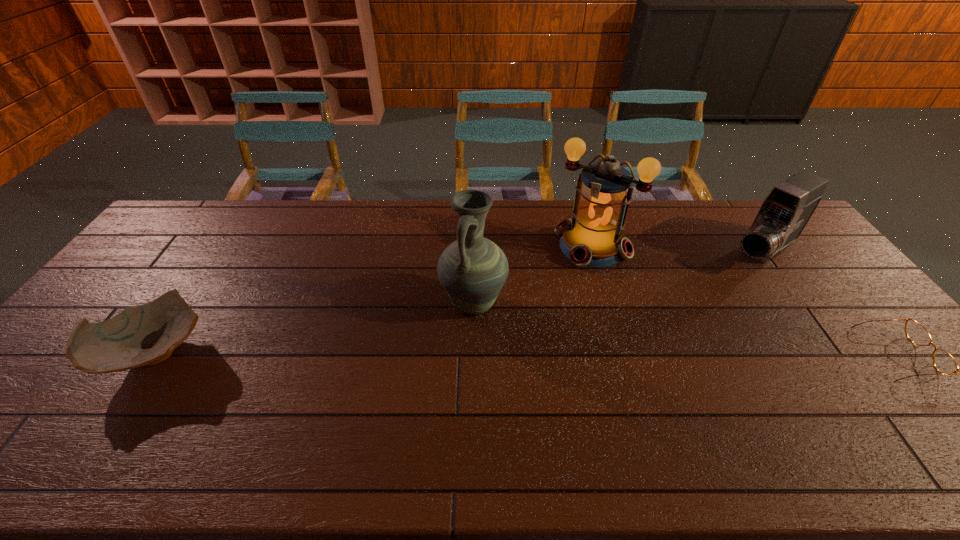
Image resolution: width=960 pixels, height=540 pixels. In order to click on free space located 0.080m at the front of the camcorder, highlighting the lens in this screenshot , I will do `click(726, 278)`.

This screenshot has height=540, width=960. Identify the location of free space located 0.260m at the front of the camcorder, highlighting the lens. (690, 303).

This screenshot has width=960, height=540. What are the coordinates of `vacant area situated at the front of the camcorder, highlighting the lens` in the screenshot? It's located at (692, 301).

At what (x,y) coordinates should I click in order to perform the action: click on vacant space located on the handle side of the fourth object from right to left. Please return your answer as a coordinate pair (x, y). Looking at the image, I should click on (401, 366).

You are a GUI agent. You are given a task and a screenshot of the screen. Output one action in this format:
    pyautogui.click(x=<x>, y=<y>)
    Task: Click on the free region located on the handle side of the fourth object from right to left
    Image resolution: width=960 pixels, height=540 pixels.
    Given the screenshot: What is the action you would take?
    pyautogui.click(x=365, y=398)

Where is `free space located 0.100m on the handle side of the fourth object from right to left`? The image size is (960, 540). free space located 0.100m on the handle side of the fourth object from right to left is located at coordinates (426, 344).

You are a GUI agent. You are given a task and a screenshot of the screen. Output one action in this format:
    pyautogui.click(x=<x>, y=<y>)
    Task: Click on the lantern at the far edge
    This screenshot has height=540, width=960.
    Given the screenshot: What is the action you would take?
    pyautogui.click(x=593, y=237)

Where is `camcorder situated at the far edge`? This screenshot has height=540, width=960. camcorder situated at the far edge is located at coordinates (783, 215).

The image size is (960, 540). In order to click on object located in the near edge section of the desktop in this screenshot , I will do `click(144, 335)`.

Image resolution: width=960 pixels, height=540 pixels. I want to click on object that is positioned at the left edge, so pyautogui.click(x=144, y=335).